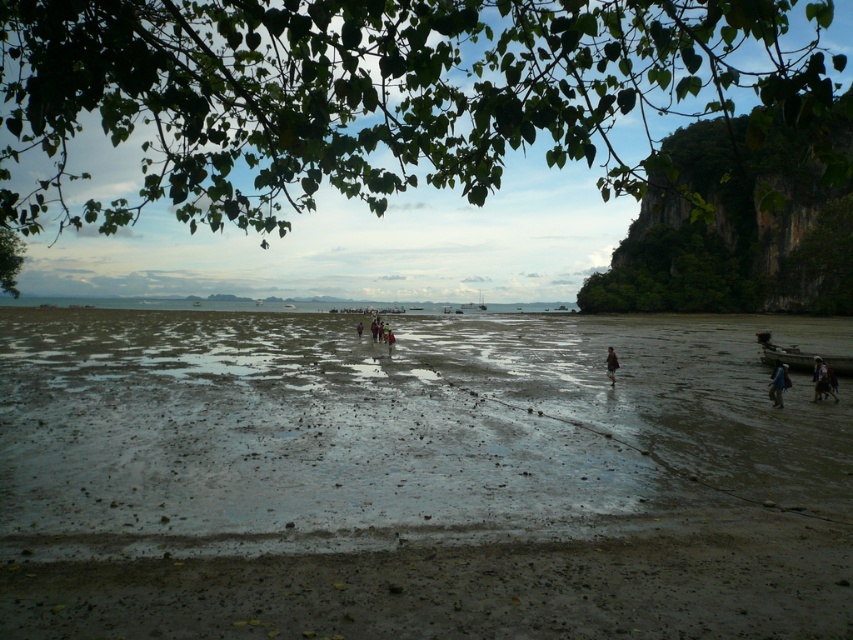
Can you confirm if dark blue fabric person at lower right is smaller than dark blue jeans at center?

Indeed, dark blue fabric person at lower right has a smaller size compared to dark blue jeans at center.

In the scene shown: Is dark blue fabric person at lower right positioned before dark blue jeans at center?

Yes, it is.

What do you see at coordinates (822, 380) in the screenshot? I see `dark blue fabric person at lower right` at bounding box center [822, 380].

Locate an element on the screen. dark blue fabric person at lower right is located at coordinates (822, 380).

Which is behind, point (825, 388) or point (610, 378)?

The point (610, 378) is behind.

Based on the photo, which is above, dark blue fabric person at lower right or brown fabric person at lower right?

brown fabric person at lower right is higher up.

What do you see at coordinates (822, 380) in the screenshot? I see `dark blue fabric person at lower right` at bounding box center [822, 380].

The image size is (853, 640). I want to click on dark blue fabric person at lower right, so click(822, 380).

Does muddy sand at center have a smaller size compared to blue fabric bag at lower right?

No, muddy sand at center is not smaller than blue fabric bag at lower right.

Which is more to the left, muddy sand at center or blue fabric bag at lower right?

From the viewer's perspective, muddy sand at center appears more on the left side.

Is point (592, 592) positioned before point (775, 397)?

Yes, point (592, 592) is in front of point (775, 397).

At what (x,y) coordinates should I click in order to perform the action: click on muddy sand at center. Please return your answer as a coordinate pair (x, y). This screenshot has width=853, height=640. Looking at the image, I should click on (416, 477).